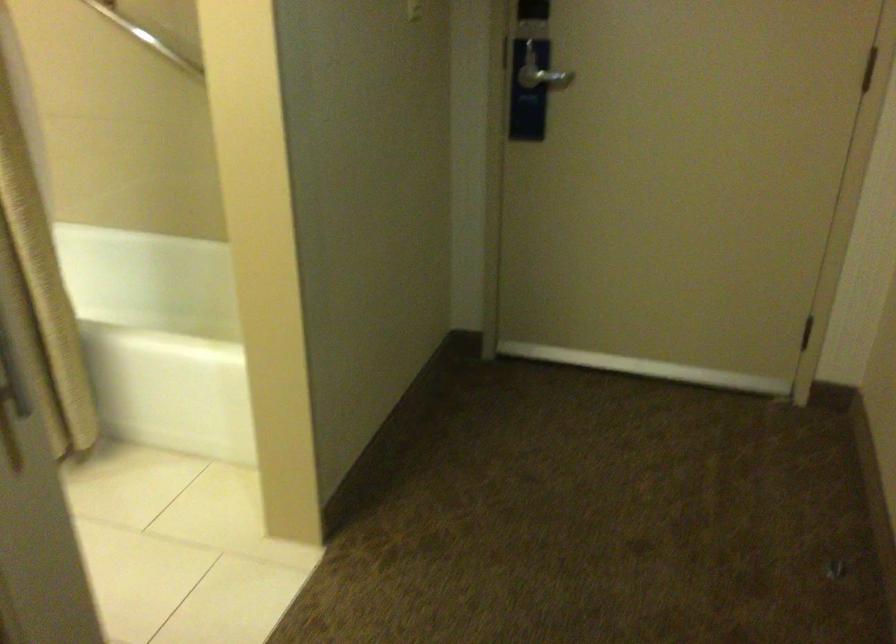
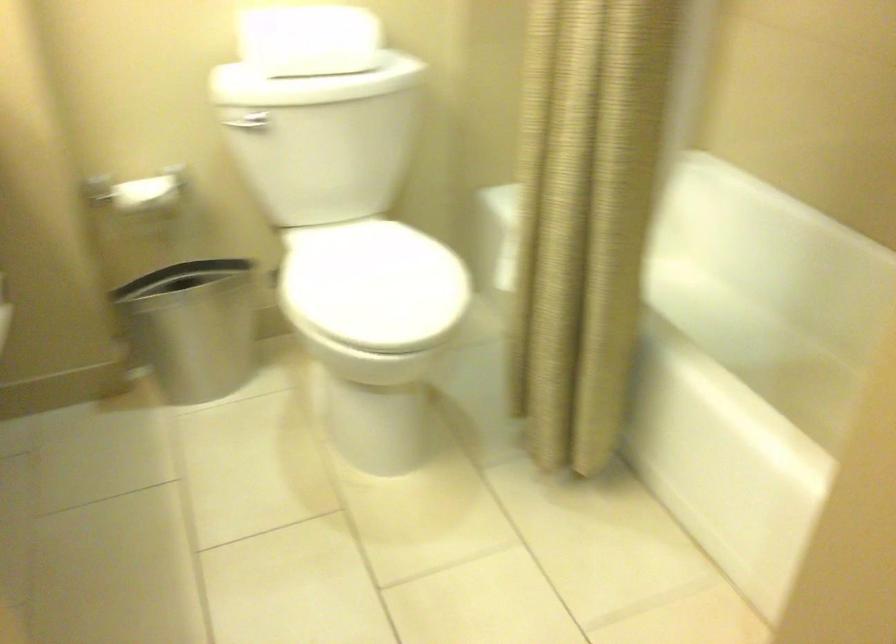
How did the camera likely rotate?

The rotation direction of the camera is left-down.